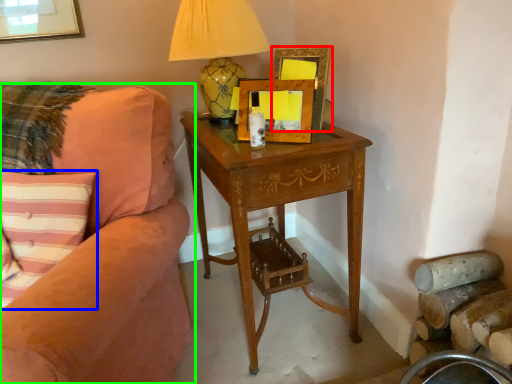
Question: Based on their relative distances, which object is nearer to picture frame (highlighted by a red box)? Choose from pillow (highlighted by a blue box) and studio couch (highlighted by a green box).

Choices:
 (A) pillow
 (B) studio couch

Answer: (B)